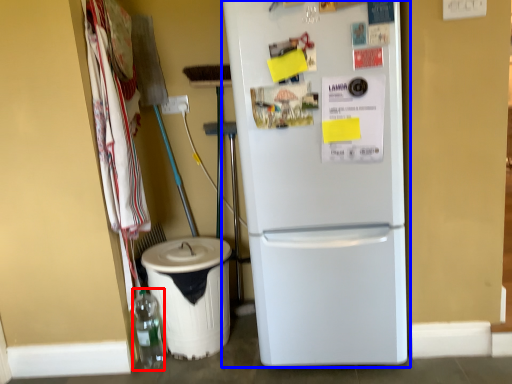
Question: Which of the following is the closest to the observer, bottle (highlighted by a red box) or refrigerator (highlighted by a blue box)?

Choices:
 (A) bottle
 (B) refrigerator

Answer: (B)